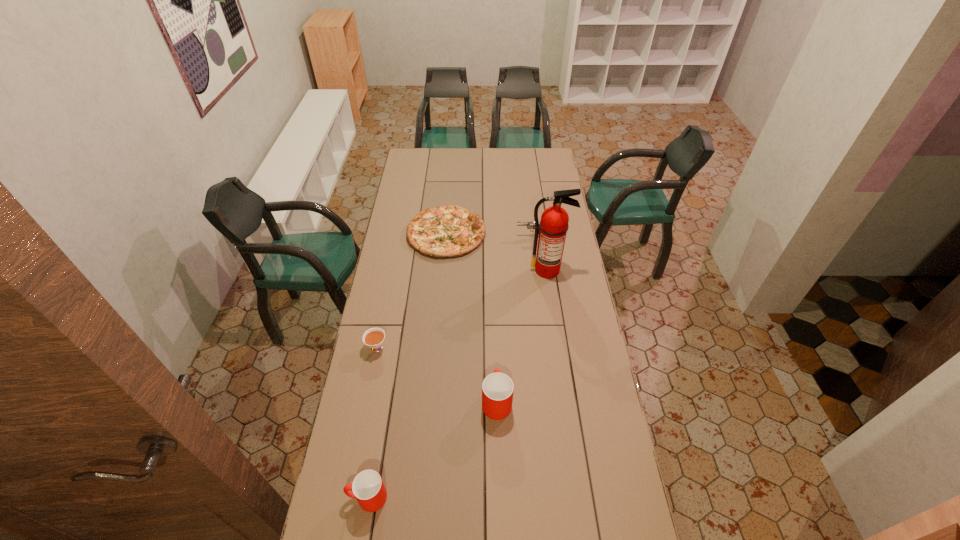
Locate an element on the screen. vacant area located 0.390m on the side of the right cup with the handle is located at coordinates (493, 302).

Where is `vacant space situated on the side of the right cup with the handle`? The width and height of the screenshot is (960, 540). vacant space situated on the side of the right cup with the handle is located at coordinates (495, 357).

Image resolution: width=960 pixels, height=540 pixels. I want to click on free region located on the side of the right cup with the handle, so click(494, 325).

What are the coordinates of `vacant space located at the barrel of the pistol` in the screenshot? It's located at (446, 237).

Locate an element on the screen. free spot located at the barrel of the pistol is located at coordinates (488, 237).

Image resolution: width=960 pixels, height=540 pixels. In order to click on free space located 0.180m at the barrel of the pistol in this screenshot , I will do `click(480, 237)`.

Locate an element on the screen. Image resolution: width=960 pixels, height=540 pixels. free space located on the side of the teacup with the handle is located at coordinates (362, 426).

At what (x,y) coordinates should I click in order to perform the action: click on free region located on the side of the fire extinguisher near the handle. Please return your answer as a coordinate pair (x, y). This screenshot has width=960, height=540. Looking at the image, I should click on (550, 288).

Find the location of `free space located 0.080m on the back of the pizza`. free space located 0.080m on the back of the pizza is located at coordinates (449, 201).

Identify the location of object located at the near edge. The image size is (960, 540). (368, 488).